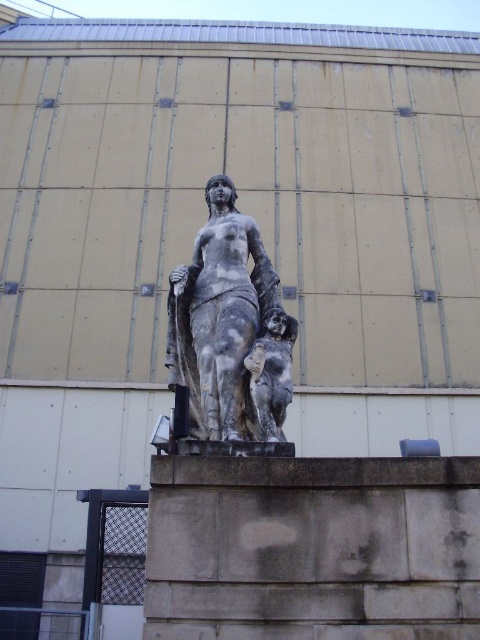
Question: Which object is farther from the camera taking this photo?

Choices:
 (A) marble statue at center
 (B) gray stone cherub at center

Answer: (A)

Question: Can you confirm if marble statue at center is wider than gray stone cherub at center?

Choices:
 (A) no
 (B) yes

Answer: (A)

Question: Which of the following is the closest to the observer?

Choices:
 (A) (182, 380)
 (B) (261, 340)

Answer: (B)

Question: Where is marble statue at center located in relation to gray stone cherub at center in the image?

Choices:
 (A) right
 (B) left

Answer: (B)

Question: Which object is farther from the camera taking this photo?

Choices:
 (A) gray stone cherub at center
 (B) marble statue at center

Answer: (B)

Question: Does marble statue at center appear on the left side of gray stone cherub at center?

Choices:
 (A) yes
 (B) no

Answer: (A)